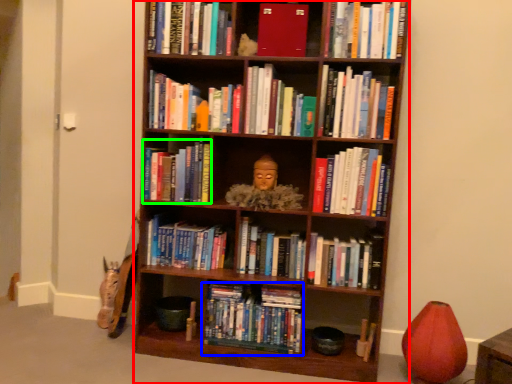
Question: Based on their relative distances, which object is nearer to bookcase (highlighted by a red box)? Choose from book (highlighted by a blue box) and book (highlighted by a green box).

Choices:
 (A) book
 (B) book

Answer: (B)